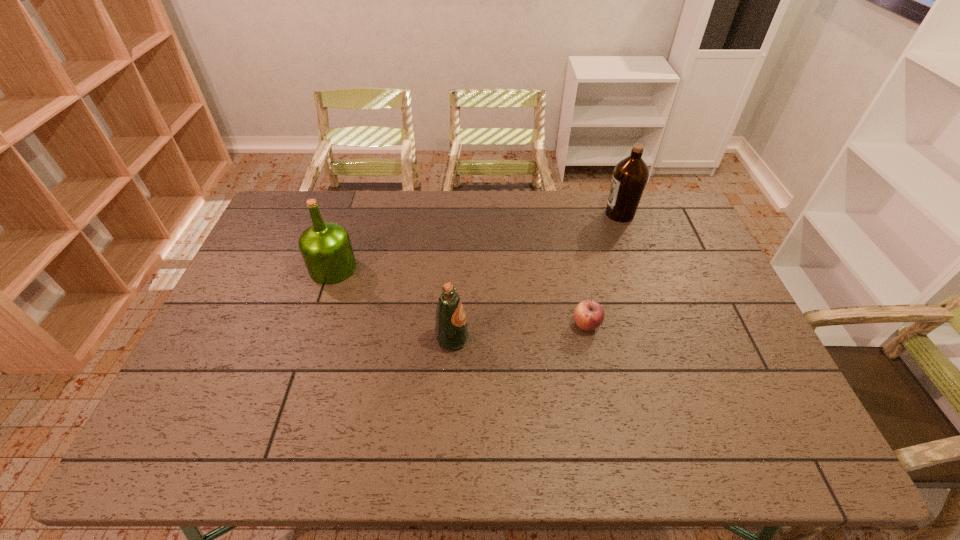
Image resolution: width=960 pixels, height=540 pixels. What are the coordinates of `vacant space that's between the shortest object and the leftmost object` in the screenshot? It's located at (460, 296).

Find the location of a particular element. This screenshot has height=540, width=960. free point between the leftmost object and the farthest object is located at coordinates [x=476, y=241].

The height and width of the screenshot is (540, 960). I want to click on vacant point located between the third object from left to right and the rightmost olive oil, so click(x=603, y=269).

You are a GUI agent. You are given a task and a screenshot of the screen. Output one action in this format:
    pyautogui.click(x=<x>, y=<y>)
    Task: Click on the empty space that is in between the leftmost olive oil and the rightmost olive oil
    This screenshot has height=540, width=960.
    Given the screenshot: What is the action you would take?
    pyautogui.click(x=476, y=241)

Locate an element on the screen. vacant point located between the third object from left to right and the farthest olive oil is located at coordinates (603, 269).

This screenshot has height=540, width=960. In order to click on free space between the third nearest object and the farthest object in this screenshot , I will do `click(476, 241)`.

You are a GUI agent. You are given a task and a screenshot of the screen. Output one action in this format:
    pyautogui.click(x=<x>, y=<y>)
    Task: Click on the free space between the rightmost object and the apple
    
    Given the screenshot: What is the action you would take?
    pyautogui.click(x=603, y=269)

Where is `free space between the shortest olive oil and the leftmost object`? free space between the shortest olive oil and the leftmost object is located at coordinates (393, 303).

Find the location of a particular element. The height and width of the screenshot is (540, 960). unoccupied area between the second nearest olive oil and the farthest olive oil is located at coordinates (476, 241).

Locate an element on the screen. The height and width of the screenshot is (540, 960). object that can be found as the second closest to the farthest olive oil is located at coordinates (451, 330).